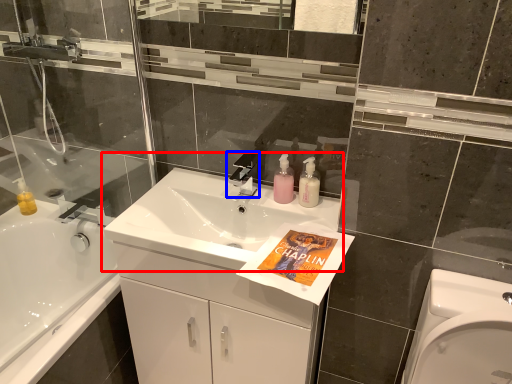
Question: Which object appears farthest to the camera in this image, sink (highlighted by a red box) or tap (highlighted by a blue box)?

Choices:
 (A) sink
 (B) tap

Answer: (B)